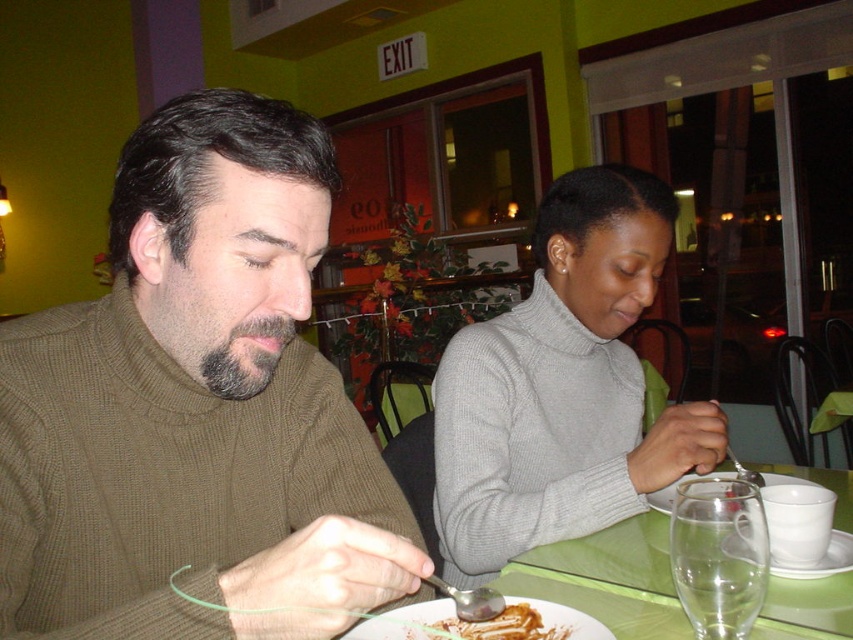
Question: Which object is the farthest from the gray woolen sweater at center?

Choices:
 (A) green plastic table at lower center
 (B) golden brown crumbly pastry at lower center

Answer: (B)

Question: Does green plastic table at lower center have a lesser width compared to golden brown crumbly pastry at lower center?

Choices:
 (A) no
 (B) yes

Answer: (A)

Question: Does knit brown sweater at left lie in front of golden brown crumbly pastry at lower center?

Choices:
 (A) no
 (B) yes

Answer: (B)

Question: Is knit brown sweater at left behind gray woolen sweater at center?

Choices:
 (A) no
 (B) yes

Answer: (A)

Question: Which of these objects is positioned farthest from the gray woolen sweater at center?

Choices:
 (A) green plastic table at lower center
 (B) golden brown crumbly pastry at lower center
 (C) knit brown sweater at left

Answer: (B)

Question: Which object is closer to the camera taking this photo?

Choices:
 (A) green plastic table at lower center
 (B) golden brown crumbly pastry at lower center
 (C) gray woolen sweater at center

Answer: (B)